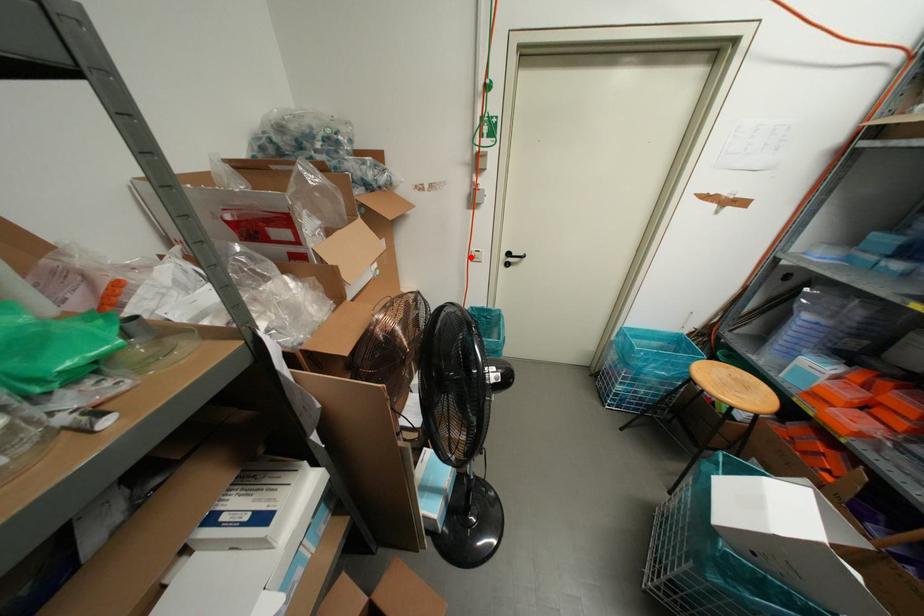
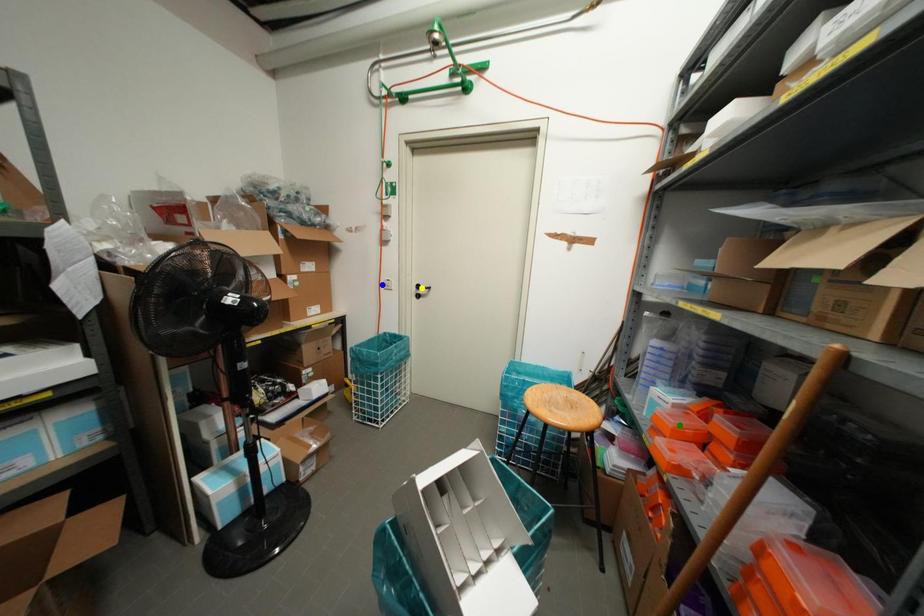
Question: I am providing you with two images of the same scene from different viewpoints. A red point is marked on the first image. You are given multiple points on the second image. Which mark in image 2 goes with the point in image 1?

Choices:
 (A) green point
 (B) blue point
 (C) yellow point

Answer: (B)